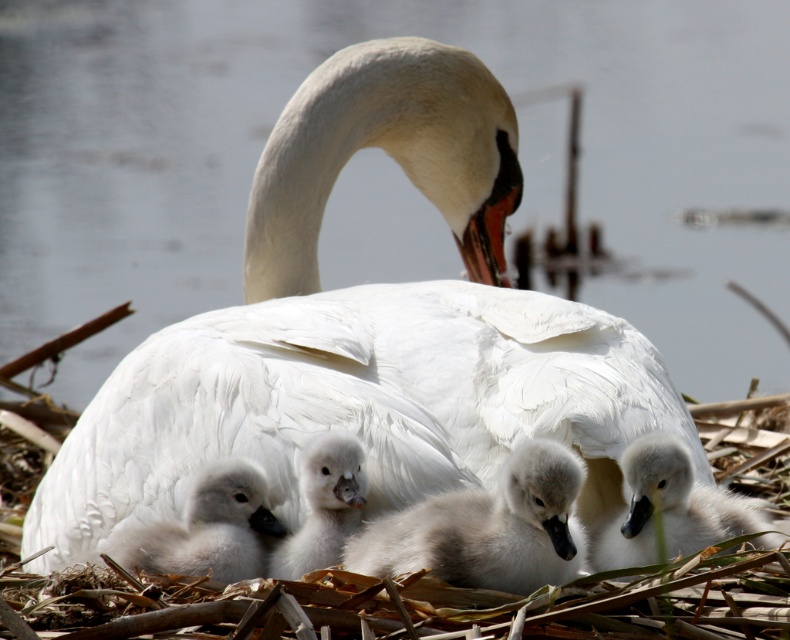
Can you confirm if soft gray downy cygnet at center is smaller than white fluffy swan at center?

Actually, soft gray downy cygnet at center might be larger than white fluffy swan at center.

The image size is (790, 640). Describe the element at coordinates (486, 529) in the screenshot. I see `soft gray downy cygnet at center` at that location.

Does point (382, 561) come in front of point (330, 461)?

Yes, it is.

At what (x,y) coordinates should I click in order to perform the action: click on soft gray downy cygnet at center. Please return your answer as a coordinate pair (x, y). This screenshot has height=640, width=790. Looking at the image, I should click on (486, 529).

Who is more forward, (604, 566) or (247, 547)?

Positioned in front is point (604, 566).

Can you confirm if soft gray down at center is positioned below fluffy white cygnet at lower left?

Actually, soft gray down at center is above fluffy white cygnet at lower left.

Does point (685, 464) lie in front of point (246, 516)?

Yes, point (685, 464) is closer to viewer.

Where is `soft gray down at center`? This screenshot has width=790, height=640. soft gray down at center is located at coordinates (672, 509).

Is fluffy white cygnet at lower left to the right of white fluffy swan at center from the viewer's perspective?

Incorrect, fluffy white cygnet at lower left is not on the right side of white fluffy swan at center.

Is point (204, 532) behind point (322, 481)?

No.

I want to click on fluffy white cygnet at lower left, so click(207, 529).